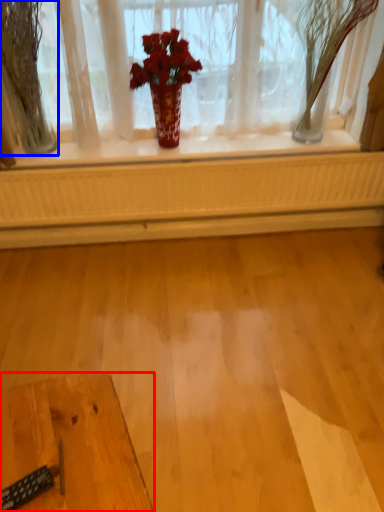
Question: Which of the following is the farthest to the observer, table (highlighted by a red box) or tree (highlighted by a blue box)?

Choices:
 (A) table
 (B) tree

Answer: (B)